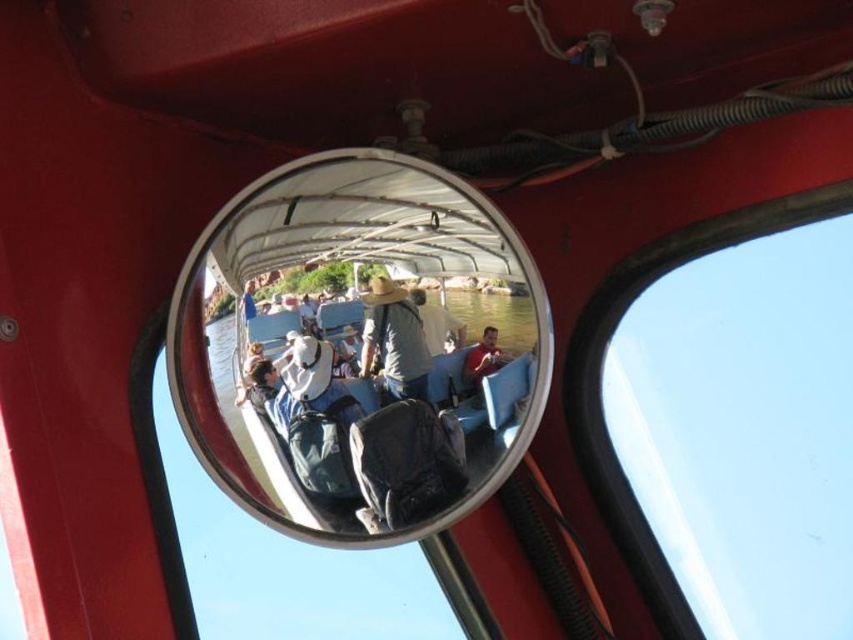
Image resolution: width=853 pixels, height=640 pixels. What do you see at coordinates (366, 348) in the screenshot?
I see `metallic reflective mirror at center` at bounding box center [366, 348].

From the picture: Who is more distant from viewer, (491,397) or (463,372)?

The point (491,397) is more distant.

In order to click on metallic reflective mirror at center in this screenshot , I will do `click(366, 348)`.

Does light brown straw hat at center have a greater height compared to matte gray shirt at center?

Indeed, light brown straw hat at center has a greater height compared to matte gray shirt at center.

Consider the image. Is light brown straw hat at center smaller than matte gray shirt at center?

No, light brown straw hat at center is not smaller than matte gray shirt at center.

Locate an element on the screen. The image size is (853, 640). light brown straw hat at center is located at coordinates (393, 340).

Is metallic reflective mirror at center closer to camera compared to light brown straw hat at center?

Yes, metallic reflective mirror at center is closer to the viewer.

Can you confirm if metallic reflective mirror at center is positioned above light brown straw hat at center?

Actually, metallic reflective mirror at center is below light brown straw hat at center.

The height and width of the screenshot is (640, 853). Find the location of `metallic reflective mirror at center`. metallic reflective mirror at center is located at coordinates (366, 348).